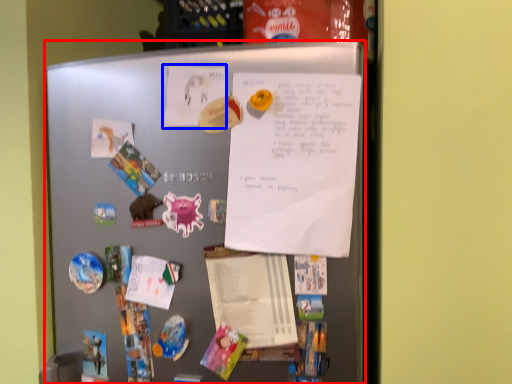
Question: Which object appears closest to the camera in this image, refrigerator (highlighted by a red box) or poster (highlighted by a blue box)?

Choices:
 (A) refrigerator
 (B) poster

Answer: (A)